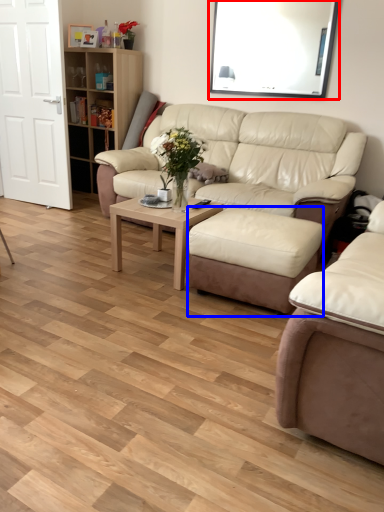
Question: Which of the following is the farthest to the observer, window screen (highlighted by a red box) or stool (highlighted by a blue box)?

Choices:
 (A) window screen
 (B) stool

Answer: (A)